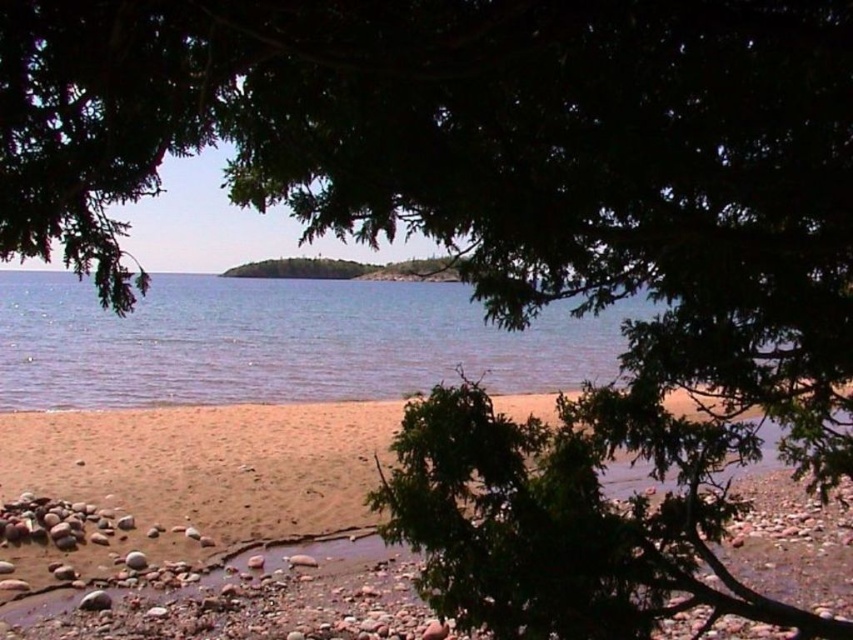
You are standing at the point marked by the coordinates point (x=550, y=532). What type of terrain are you currently standing on?

You are standing on brown sand at lower center, as the brown sand at lower center is located at point (x=550, y=532).

Looking at this image, you are a beachcomber looking for items washed ashore. You have a small bucket that can hold up to 2 liters of sand. You see the brown sand at lower center and the clear blue water at center. Which of these two would you collect to fill your bucket efficiently?

The brown sand at lower center has a smaller size compared to clear blue water at center, so the brown sand at lower center can be packed more tightly into the bucket, allowing you to fill it more efficiently.